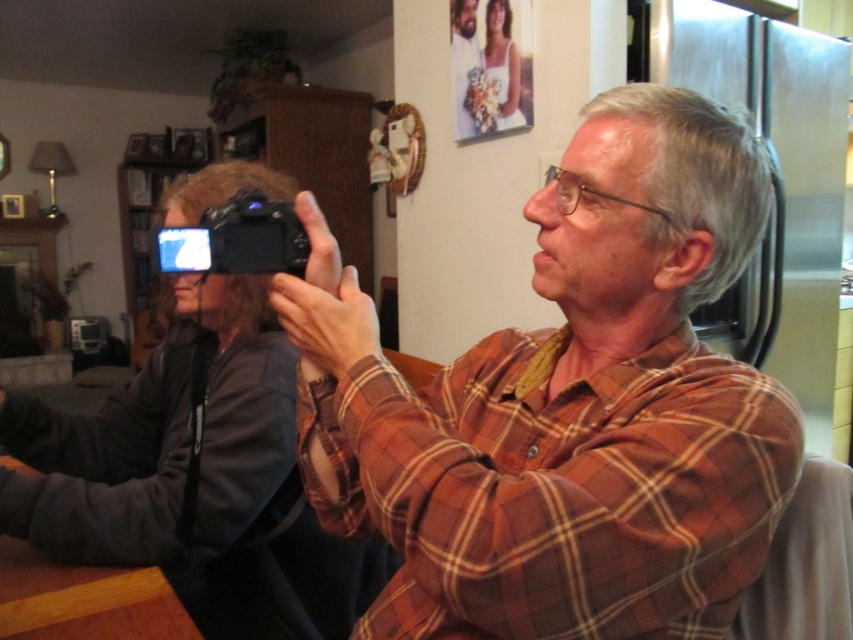
You are a photographer organizing a photo shoot. You have a black plastic camera at center and a satin white dress at upper center in the scene. Which object is shorter in height?

The black plastic camera at center is not as tall as the satin white dress at upper center, so the black plastic camera at center is shorter in height.

You are a tailor who needs to adjust the brown plaid shirt at center so it fits better around the black plastic camera at center. How far apart are these two items currently?

The brown plaid shirt at center is 26.95 centimeters away from the black plastic camera at center.